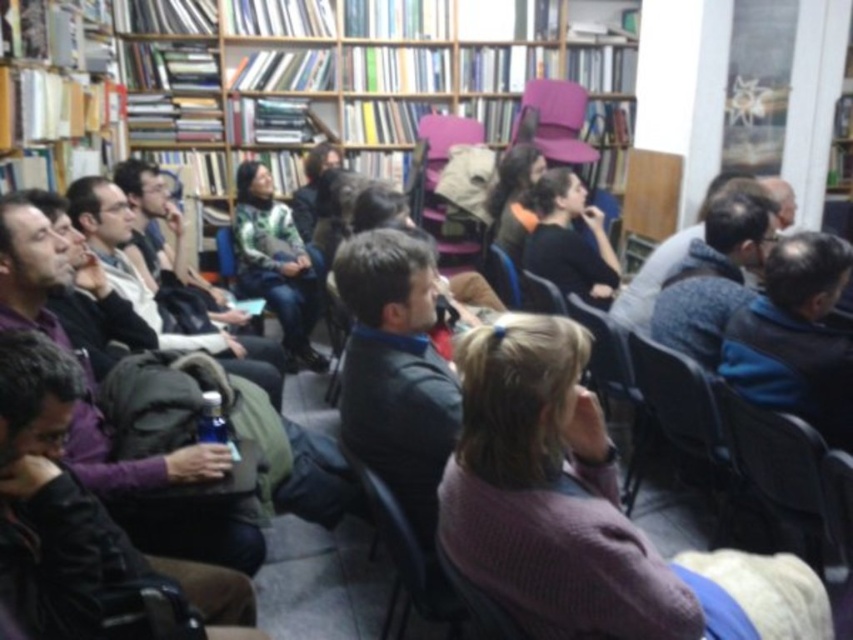
You are standing in a library and see a green textured sweater at center. If you want to reach it without moving your feet, can you do so?

The green textured sweater at center is 4.03 meters away from camera, so you cannot reach it without moving your feet since it is too far.

In the scene shown: You are organizing a small event in the library and need to place a new table between the wooden bookcase at upper center and the pink fabric chair at upper center. The table is 1.2 meters wide. Is there enough space between them?

The wooden bookcase at upper center is bigger than the pink fabric chair at upper center, but the exact distance between them isn not specified in the provided information. Therefore, it is uncertain whether the 1.2 meter wide table will fit.

You are organizing a small event in this library and need to place a 25 cm wide decorative item between the green textured sweater at center and the wooden chair at center. Based on the available space, will the item fit comfortably?

The distance between the green textured sweater at center and the wooden chair at center is 22.76 centimeters. Since the decorative item is 25 cm wide, it will not fit comfortably in the space provided.